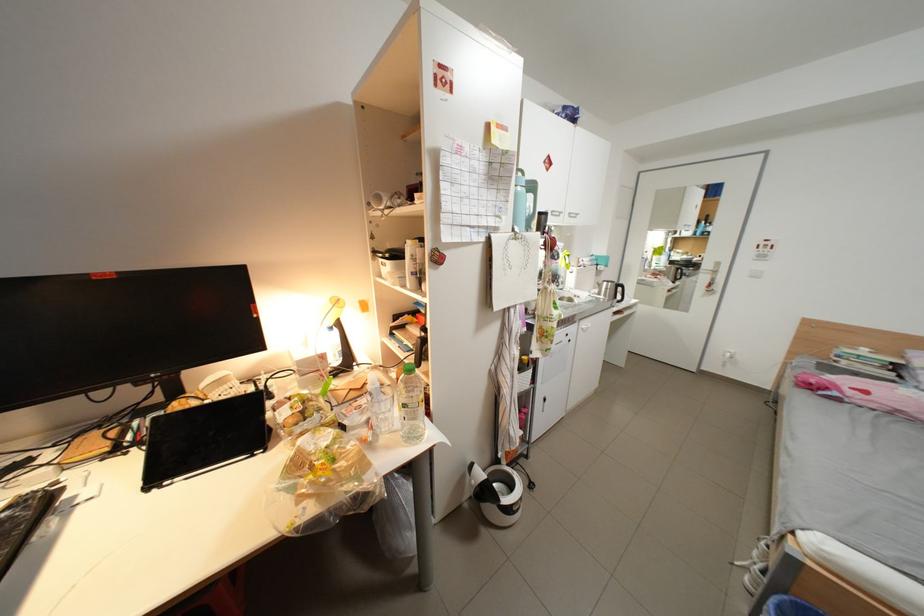
Image resolution: width=924 pixels, height=616 pixels. Describe the element at coordinates (585, 325) in the screenshot. I see `a white cabinet handle` at that location.